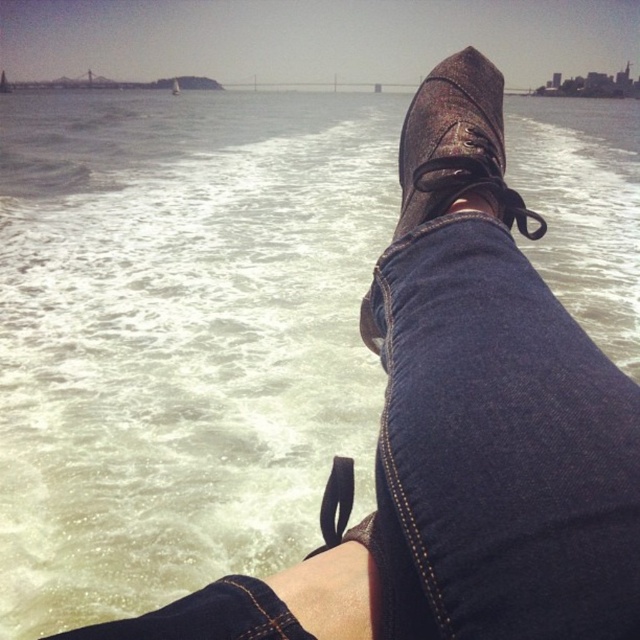
You are designing a storage box to fit both the leather boot at center and the white plastic sailboat at upper center. Since you want the box to be as small as possible, which object determines the minimum width required for the box?

The white plastic sailboat at upper center determines the minimum width required for the box because its width is greater than the leather boot at center.

You are standing on the dock and see the leather boot at center floating in the water. You want to reach it without getting your feet wet. The dock is 1 meter wide. Can you safely step onto the dock and reach the boot?

The distance between the leather boot at center and the viewer is 90.38 centimeters. Since the dock is 1 meter wide, you can safely step onto the dock and reach the boot as the distance is within the dock width.

You are standing on a dock and looking at the point marked as point (456, 145). What object is located at that point?

The point (456, 145) corresponds to the leather boot at center.